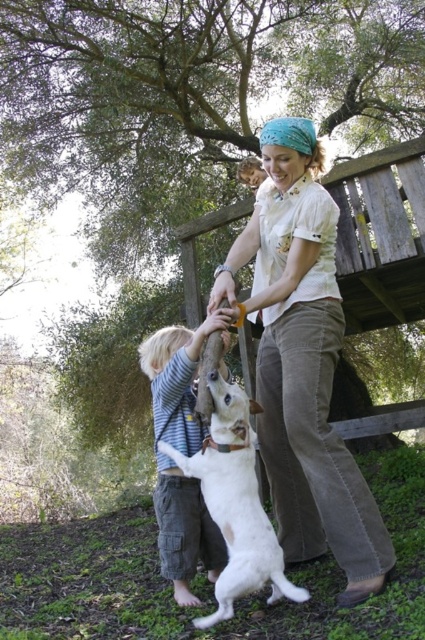
Who is positioned more to the left, light beige corduroy pants at center or white fur dog at center?

white fur dog at center

Identify the location of light beige corduroy pants at center. This screenshot has width=425, height=640. (303, 364).

Locate an element on the screen. The width and height of the screenshot is (425, 640). light beige corduroy pants at center is located at coordinates (303, 364).

Who is more distant from viewer, (x=303, y=362) or (x=181, y=480)?

Point (x=181, y=480)

Find the location of a particular element. Image resolution: width=425 pixels, height=640 pixels. light beige corduroy pants at center is located at coordinates (303, 364).

Does point (323, 493) lie behind point (178, 346)?

No, (323, 493) is in front of (178, 346).

This screenshot has height=640, width=425. Find the location of `light beige corduroy pants at center`. light beige corduroy pants at center is located at coordinates (303, 364).

Who is positioned more to the left, striped cotton shirt at center or white fur dog at center?

striped cotton shirt at center

Is striped cotton shirt at center below white fur dog at center?

Actually, striped cotton shirt at center is above white fur dog at center.

The height and width of the screenshot is (640, 425). I want to click on striped cotton shirt at center, so click(x=183, y=452).

The height and width of the screenshot is (640, 425). Identify the location of striped cotton shirt at center. (183, 452).